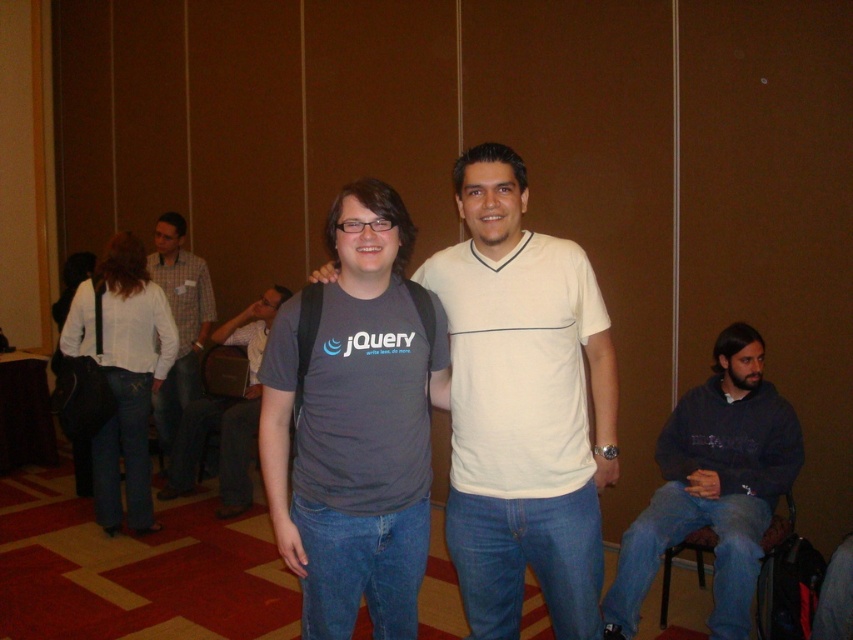
Question: Which object is the farthest from the white shirt at left?

Choices:
 (A) gray matte shirt at center
 (B) dark gray sweatshirt at lower right
 (C) gray fabric shirt at center
 (D) white denim jeans at lower left

Answer: (C)

Question: Can you confirm if dark gray sweatshirt at lower right is thinner than brown fabric chair at lower right?

Choices:
 (A) yes
 (B) no

Answer: (B)

Question: Is white denim jeans at lower left bigger than white shirt at left?

Choices:
 (A) yes
 (B) no

Answer: (B)

Question: Which object is positioned closest to the brown fabric chair at lower right?

Choices:
 (A) gray matte shirt at center
 (B) dark gray sweatshirt at lower right

Answer: (B)

Question: Which of the following is the closest to the observer?

Choices:
 (A) tap(251, 500)
 (B) tap(177, 394)
 (C) tap(711, 536)
 (D) tap(544, 298)

Answer: (D)

Question: Is gray fabric shirt at center closer to the viewer compared to white denim jeans at lower left?

Choices:
 (A) no
 (B) yes

Answer: (B)